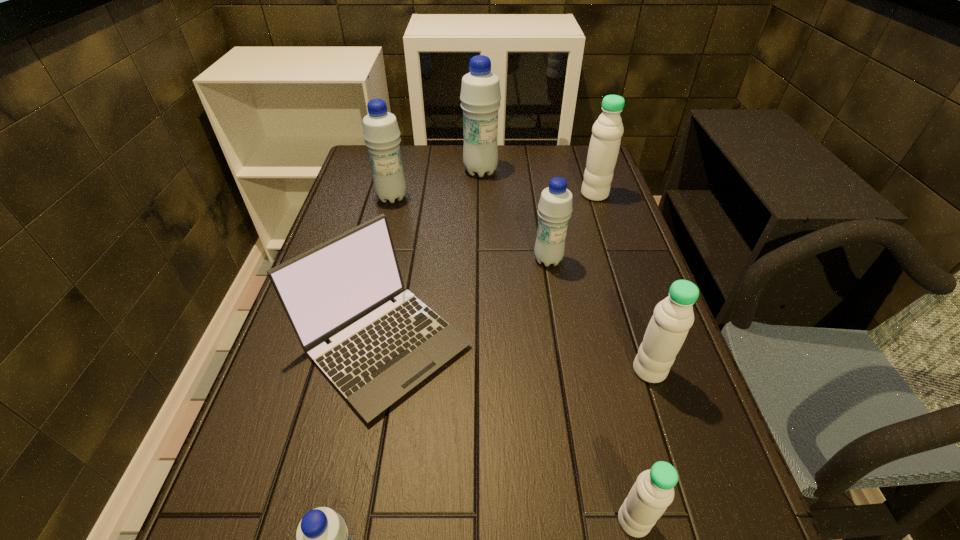
Where is `vacant space that satisfies the following two spatial constraints: 1. at the front screen of the seventh farthest object; 2. on the left side of the laptop_computer`? The height and width of the screenshot is (540, 960). vacant space that satisfies the following two spatial constraints: 1. at the front screen of the seventh farthest object; 2. on the left side of the laptop_computer is located at coordinates (349, 521).

This screenshot has height=540, width=960. I want to click on blank area in the image that satisfies the following two spatial constraints: 1. at the front screen of the third nearest water bottle; 2. on the left side of the laptop_computer, so click(x=379, y=370).

The image size is (960, 540). I want to click on vacant area that satisfies the following two spatial constraints: 1. on the front side of the fourth farthest object; 2. on the left side of the third nearest blue water bottle, so click(x=376, y=260).